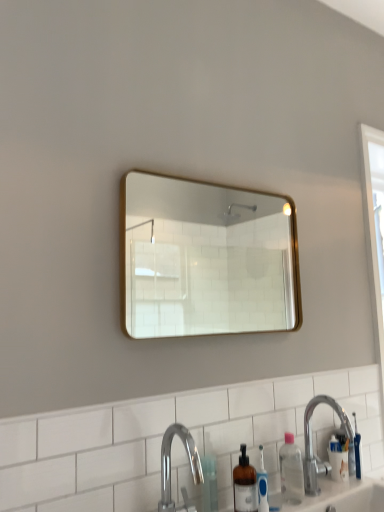
What do you see at coordinates (206, 259) in the screenshot? I see `gold-framed mirror at upper center` at bounding box center [206, 259].

What is the approximate height of gold-framed mirror at upper center?

20.83 inches.

This screenshot has height=512, width=384. What do you see at coordinates (291, 470) in the screenshot? I see `clear plastic bottle at lower right` at bounding box center [291, 470].

In order to click on silver metallic sink at lower right in this screenshot , I will do `click(330, 475)`.

What do you see at coordinates (170, 463) in the screenshot? I see `polished chrome faucet at lower center` at bounding box center [170, 463].

What is the approximate height of translucent plastic bottle at lower center?

translucent plastic bottle at lower center is 18.31 centimeters in height.

The height and width of the screenshot is (512, 384). What are the coordinates of `translucent plastic bottle at lower center` in the screenshot? It's located at (209, 484).

Locate an element on the screen. This screenshot has height=512, width=384. gold-framed mirror at upper center is located at coordinates (206, 259).

From the image's perspective, which is above, silver metallic sink at lower right or white wood screen door at right?

white wood screen door at right.

How distant is silver metallic sink at lower right from white wood screen door at right?

A distance of 21.96 inches exists between silver metallic sink at lower right and white wood screen door at right.

Considering the relative sizes of silver metallic sink at lower right and white wood screen door at right in the image provided, is silver metallic sink at lower right thinner than white wood screen door at right?

In fact, silver metallic sink at lower right might be wider than white wood screen door at right.

From a real-world perspective, is silver metallic sink at lower right above or below white wood screen door at right?

From a real-world perspective, silver metallic sink at lower right is physically below white wood screen door at right.

Considering the sizes of objects silver metallic sink at lower right and polished chrome faucet at lower center in the image provided, who is taller, silver metallic sink at lower right or polished chrome faucet at lower center?

Answer: With more height is polished chrome faucet at lower center.

Does silver metallic sink at lower right turn towards polished chrome faucet at lower center?

No, silver metallic sink at lower right does not turn towards polished chrome faucet at lower center.

Is silver metallic sink at lower right thinner than polished chrome faucet at lower center?

No, silver metallic sink at lower right is not thinner than polished chrome faucet at lower center.

Who is more distant, silver metallic sink at lower right or polished chrome faucet at lower center?

silver metallic sink at lower right is more distant.

Would you say gold-framed mirror at upper center is inside or outside translucent plastic bottle at lower center?

gold-framed mirror at upper center is not inside translucent plastic bottle at lower center, it's outside.

Which is in front, point (153, 333) or point (205, 466)?

The point (205, 466) is closer to the camera.

Does gold-framed mirror at upper center have a greater width compared to translucent plastic bottle at lower center?

No, gold-framed mirror at upper center is not wider than translucent plastic bottle at lower center.

Is gold-framed mirror at upper center facing away from translucent plastic bottle at lower center?

No, gold-framed mirror at upper center is not facing away from translucent plastic bottle at lower center.

Considering the relative sizes of translucent plastic bottle at lower center and clear plastic bottle at lower right in the image provided, is translucent plastic bottle at lower center wider than clear plastic bottle at lower right?

No, translucent plastic bottle at lower center is not wider than clear plastic bottle at lower right.

From a real-world perspective, does translucent plastic bottle at lower center sit lower than clear plastic bottle at lower right?

Yes, from a real-world perspective, translucent plastic bottle at lower center is below clear plastic bottle at lower right.

Based on the photo, is translucent plastic bottle at lower center positioned behind clear plastic bottle at lower right?

No, it is not.

Based on the photo, from the image's perspective, who appears lower, translucent plastic bottle at lower center or clear plastic bottle at lower right?

translucent plastic bottle at lower center appears lower in the image.

Who is taller, translucent plastic bottle at lower center or gold-framed mirror at upper center?

gold-framed mirror at upper center.

Considering the points (210, 460) and (160, 256), which point is behind, point (210, 460) or point (160, 256)?

The point (160, 256) is farther.

Is translucent plastic bottle at lower center bigger than gold-framed mirror at upper center?

No.

From a real-world perspective, is translucent plastic bottle at lower center on top of gold-framed mirror at upper center?

Actually, translucent plastic bottle at lower center is physically below gold-framed mirror at upper center in the real world.

Consider the image. Between silver metallic sink at lower right and translucent plastic bottle at lower center, which one has smaller size?

translucent plastic bottle at lower center is smaller.

From the picture: Which is more to the right, silver metallic sink at lower right or translucent plastic bottle at lower center?

silver metallic sink at lower right.

From a real-world perspective, which is physically above, silver metallic sink at lower right or clear plastic bottle at lower right?

silver metallic sink at lower right.

Is point (293, 504) farther from camera compared to point (292, 436)?

No.

Can you confirm if silver metallic sink at lower right is bigger than clear plastic bottle at lower right?

Yes, silver metallic sink at lower right is bigger than clear plastic bottle at lower right.

Considering the positions of objects silver metallic sink at lower right and clear plastic bottle at lower right in the image provided, who is more to the left, silver metallic sink at lower right or clear plastic bottle at lower right?

clear plastic bottle at lower right is more to the left.

This screenshot has width=384, height=512. In order to click on screen door above the silver metallic sink at lower right (from a real-world perspective) in this screenshot , I will do `click(374, 231)`.

Where is `tap below the silver metallic sink at lower right (from a real-world perspective)`? The height and width of the screenshot is (512, 384). tap below the silver metallic sink at lower right (from a real-world perspective) is located at coordinates (170, 463).

From the image, which object appears to be farther from white wood screen door at right, clear plastic bottle at lower right or translucent plastic bottle at lower center?

translucent plastic bottle at lower center is further to white wood screen door at right.

Based on their spatial positions, is polished chrome faucet at lower center or silver metallic sink at lower right closer to clear plastic bottle at lower right?

Among the two, silver metallic sink at lower right is located nearer to clear plastic bottle at lower right.

Which object lies further to the anchor point translucent plastic bottle at lower center, clear plastic bottle at lower right or white wood screen door at right?

Answer: white wood screen door at right lies further to translucent plastic bottle at lower center than the other object.

In the scene shown: Considering their positions, is translucent plastic bottle at lower center positioned further to white wood screen door at right than silver metallic sink at lower right?

The object further to white wood screen door at right is translucent plastic bottle at lower center.

Considering their positions, is translucent plastic bottle at lower center positioned closer to silver metallic sink at lower right than clear plastic bottle at lower right?

clear plastic bottle at lower right is closer to silver metallic sink at lower right.

Estimate the real-world distances between objects in this image. Which object is closer to silver metallic sink at lower right, translucent plastic bottle at lower center or gold-framed mirror at upper center?

translucent plastic bottle at lower center is positioned closer to the anchor silver metallic sink at lower right.

Looking at the image, which one is located closer to clear plastic bottle at lower right, translucent plastic bottle at lower center or gold-framed mirror at upper center?

Based on the image, translucent plastic bottle at lower center appears to be nearer to clear plastic bottle at lower right.

Looking at the image, which one is located further to white wood screen door at right, gold-framed mirror at upper center or silver metallic sink at lower right?

gold-framed mirror at upper center lies further to white wood screen door at right than the other object.

I want to click on bottle situated between translucent plastic bottle at lower center and silver metallic sink at lower right from left to right, so click(x=291, y=470).

Locate an element on the screen. tap that lies between gold-framed mirror at upper center and clear plastic bottle at lower right from top to bottom is located at coordinates [x=170, y=463].

At what (x,y) coordinates should I click in order to perform the action: click on tap between gold-framed mirror at upper center and silver metallic sink at lower right vertically. Please return your answer as a coordinate pair (x, y). Image resolution: width=384 pixels, height=512 pixels. Looking at the image, I should click on (170, 463).

Identify the location of sink between gold-framed mirror at upper center and white wood screen door at right from left to right. The image size is (384, 512). (330, 475).